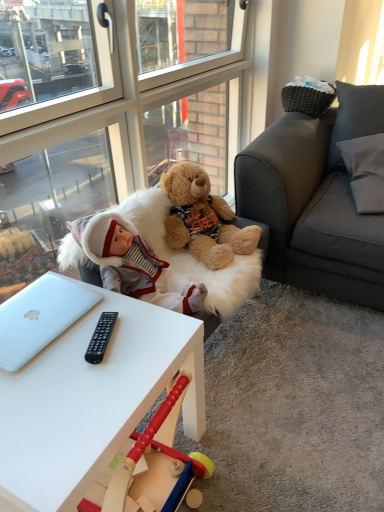
Where is `vacant area to the right of silver metallic laptop at lower left`? This screenshot has height=512, width=384. vacant area to the right of silver metallic laptop at lower left is located at coordinates 123,331.